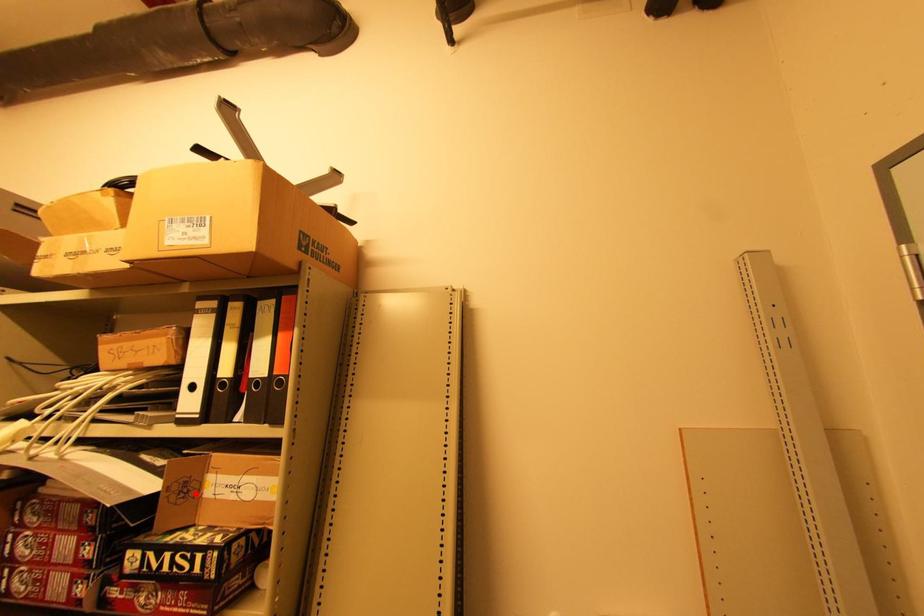
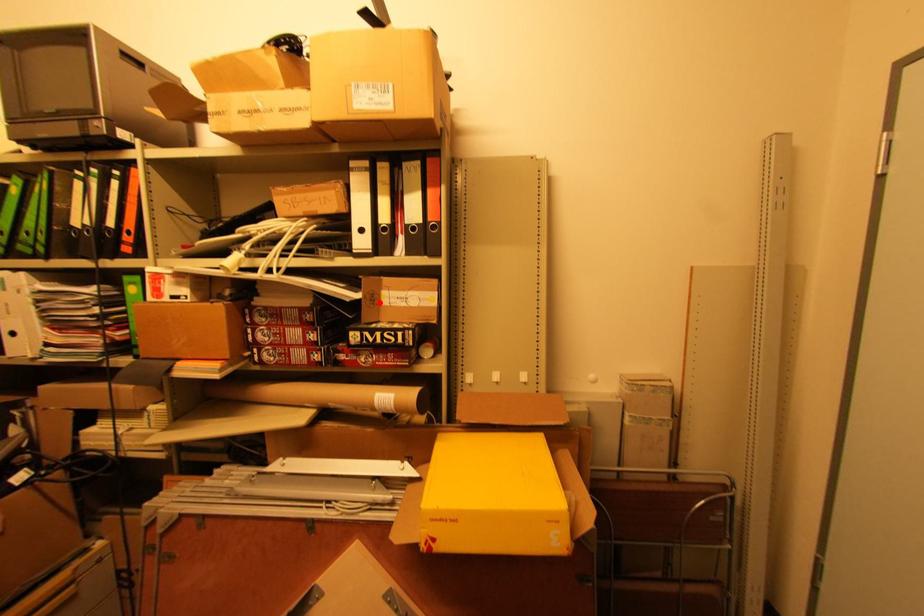
I am providing you with two images of the same scene from different viewpoints. A red point is marked on the first image and another point is marked on the second image. Does the point marked in image1 correspond to the same location as the one in image2?

Yes